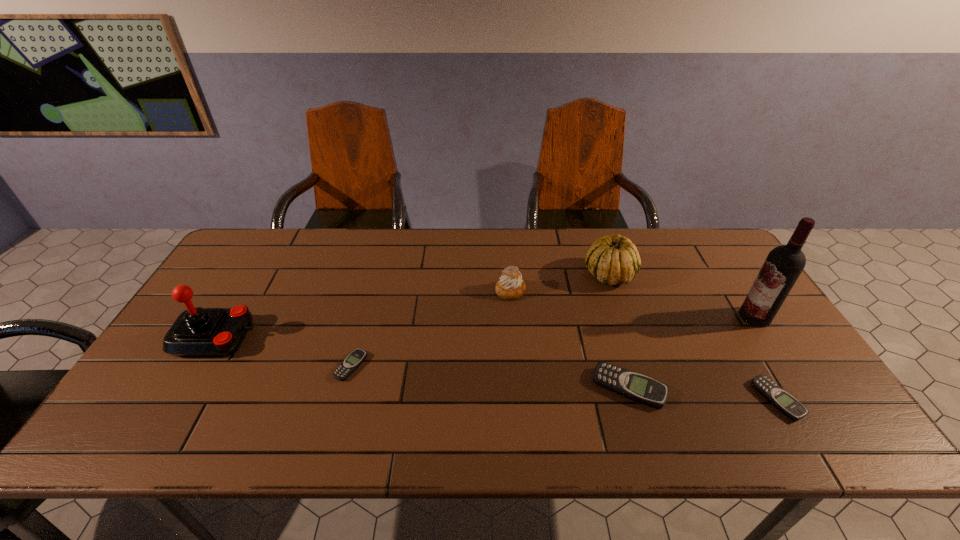
Find the location of a particular element. The width and height of the screenshot is (960, 540). joystick is located at coordinates (198, 331).

Where is `the leftmost object`? This screenshot has width=960, height=540. the leftmost object is located at coordinates (198, 331).

Where is `vacant space situated 0.110m on the back of the leftmost beeper`? This screenshot has width=960, height=540. vacant space situated 0.110m on the back of the leftmost beeper is located at coordinates (364, 320).

The width and height of the screenshot is (960, 540). I want to click on vacant space located 0.150m on the left of the tallest beeper, so click(x=532, y=388).

This screenshot has width=960, height=540. I want to click on free space located 0.240m on the left of the rightmost beeper, so click(x=658, y=400).

Where is `vacant area situated on the back of the gourd`? vacant area situated on the back of the gourd is located at coordinates (593, 230).

This screenshot has width=960, height=540. I want to click on vacant space located 0.360m on the label of the wine bottle, so click(x=613, y=317).

Where is `vacant space located on the label of the wine bottle`? The width and height of the screenshot is (960, 540). vacant space located on the label of the wine bottle is located at coordinates point(613,317).

Where is `free space located 0.250m on the label of the wine bottle`? Image resolution: width=960 pixels, height=540 pixels. free space located 0.250m on the label of the wine bottle is located at coordinates (652, 317).

Locate an element on the screen. vacant position located 0.180m on the right of the fourth shortest object is located at coordinates (585, 291).